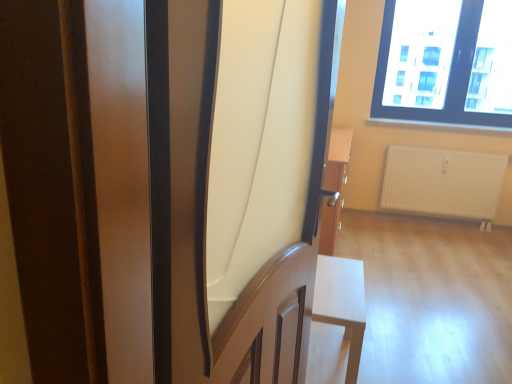
Question: From a real-world perspective, does matte wood screen door at center sit lower than transparent glass window at upper right?

Choices:
 (A) yes
 (B) no

Answer: (A)

Question: Considering the relative sizes of matte wood screen door at center and transparent glass window at upper right in the image provided, is matte wood screen door at center smaller than transparent glass window at upper right?

Choices:
 (A) no
 (B) yes

Answer: (B)

Question: Does matte wood screen door at center have a greater width compared to transparent glass window at upper right?

Choices:
 (A) no
 (B) yes

Answer: (B)

Question: Is matte wood screen door at center positioned behind transparent glass window at upper right?

Choices:
 (A) yes
 (B) no

Answer: (B)

Question: Is matte wood screen door at center taller than transparent glass window at upper right?

Choices:
 (A) no
 (B) yes

Answer: (B)

Question: Based on their sizes in the image, would you say transparent glass window at upper right is bigger or smaller than matte wood screen door at center?

Choices:
 (A) small
 (B) big

Answer: (B)

Question: In the image, is transparent glass window at upper right positioned in front of or behind matte wood screen door at center?

Choices:
 (A) behind
 (B) front

Answer: (A)

Question: In the image, is transparent glass window at upper right on the left side or the right side of matte wood screen door at center?

Choices:
 (A) left
 (B) right

Answer: (B)

Question: Is point (493, 97) closer or farther from the camera than point (151, 86)?

Choices:
 (A) closer
 (B) farther

Answer: (B)

Question: From a real-world perspective, is transparent glass window at upper right above or below white matte table at lower right?

Choices:
 (A) below
 (B) above

Answer: (B)

Question: Is point (478, 112) closer or farther from the camera than point (321, 288)?

Choices:
 (A) closer
 (B) farther

Answer: (B)

Question: Is transparent glass window at upper right to the left or to the right of white matte table at lower right in the image?

Choices:
 (A) left
 (B) right

Answer: (B)

Question: Is transparent glass window at upper right situated inside white matte table at lower right or outside?

Choices:
 (A) inside
 (B) outside

Answer: (B)

Question: Is matte wood screen door at center wider or thinner than transparent glass window at upper right?

Choices:
 (A) wide
 (B) thin

Answer: (A)

Question: From their relative heights in the image, would you say matte wood screen door at center is taller or shorter than transparent glass window at upper right?

Choices:
 (A) tall
 (B) short

Answer: (A)